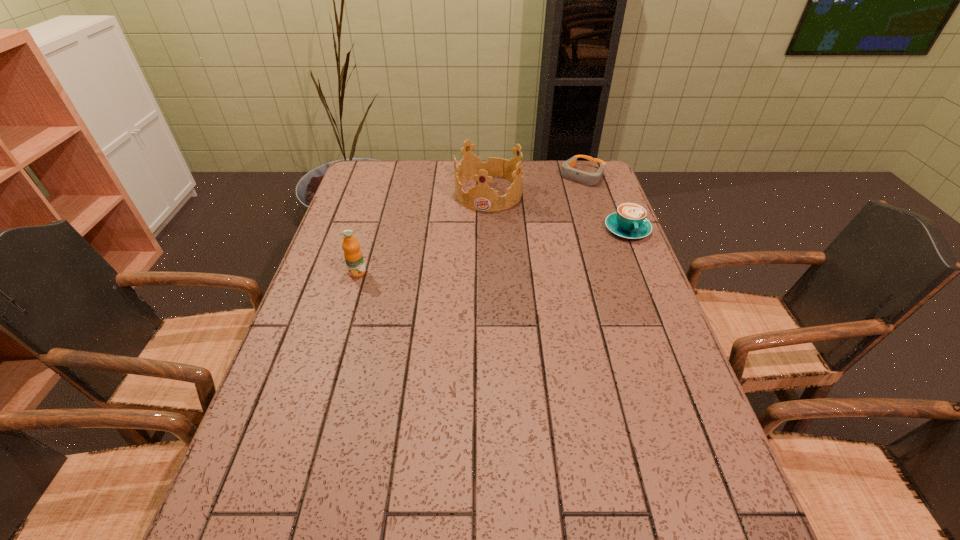
This screenshot has height=540, width=960. I want to click on free space on the desktop that is between the nearest object and the second nearest object and is positioned on the front and back of the goggles, so click(x=515, y=247).

Identify the location of vacant space on the desktop that is between the nearest object and the second nearest object and is positioned on the front-facing side of the tiara. This screenshot has height=540, width=960. 470,254.